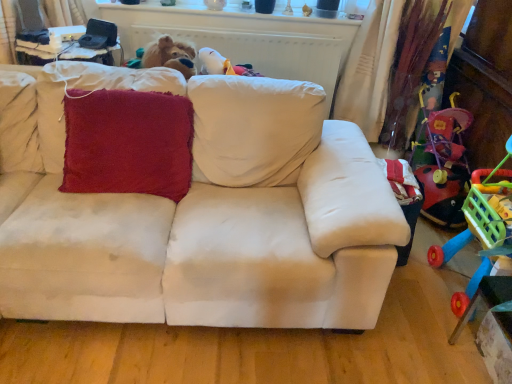
Question: Considering the relative sizes of rubberized plastic shopping cart at right and velvety red cushion at center in the image provided, is rubberized plastic shopping cart at right wider than velvety red cushion at center?

Choices:
 (A) no
 (B) yes

Answer: (B)

Question: Is rubberized plastic shopping cart at right facing away from velvety red cushion at center?

Choices:
 (A) yes
 (B) no

Answer: (B)

Question: Can you confirm if rubberized plastic shopping cart at right is smaller than velvety red cushion at center?

Choices:
 (A) no
 (B) yes

Answer: (A)

Question: From a real-world perspective, is rubberized plastic shopping cart at right located higher than velvety red cushion at center?

Choices:
 (A) yes
 (B) no

Answer: (A)

Question: Is rubberized plastic shopping cart at right further to camera compared to velvety red cushion at center?

Choices:
 (A) yes
 (B) no

Answer: (B)

Question: From the image's perspective, is rubberized plastic shopping cart at right positioned above or below velvety red cushion at center?

Choices:
 (A) below
 (B) above

Answer: (A)

Question: Does point (480, 220) appear closer or farther from the camera than point (172, 94)?

Choices:
 (A) closer
 (B) farther

Answer: (A)

Question: Is rubberized plastic shopping cart at right to the left or to the right of velvety red cushion at center in the image?

Choices:
 (A) right
 (B) left

Answer: (A)

Question: Is rubberized plastic shopping cart at right bigger or smaller than velvety red cushion at center?

Choices:
 (A) small
 (B) big

Answer: (B)

Question: From the image's perspective, is beige fabric couch at center positioned above or below rubberized plastic shopping cart at right?

Choices:
 (A) above
 (B) below

Answer: (A)

Question: Which is correct: beige fabric couch at center is inside rubberized plastic shopping cart at right, or outside of it?

Choices:
 (A) outside
 (B) inside

Answer: (A)

Question: Is point (x=259, y=324) positioned closer to the camera than point (x=484, y=249)?

Choices:
 (A) closer
 (B) farther

Answer: (B)

Question: From a real-world perspective, is beige fabric couch at center positioned above or below rubberized plastic shopping cart at right?

Choices:
 (A) below
 (B) above

Answer: (A)

Question: From a real-world perspective, is rubberized plastic shopping cart at right physically located above or below beige fabric couch at center?

Choices:
 (A) above
 (B) below

Answer: (A)

Question: Would you say rubberized plastic shopping cart at right is to the left or to the right of beige fabric couch at center in the picture?

Choices:
 (A) left
 (B) right

Answer: (B)